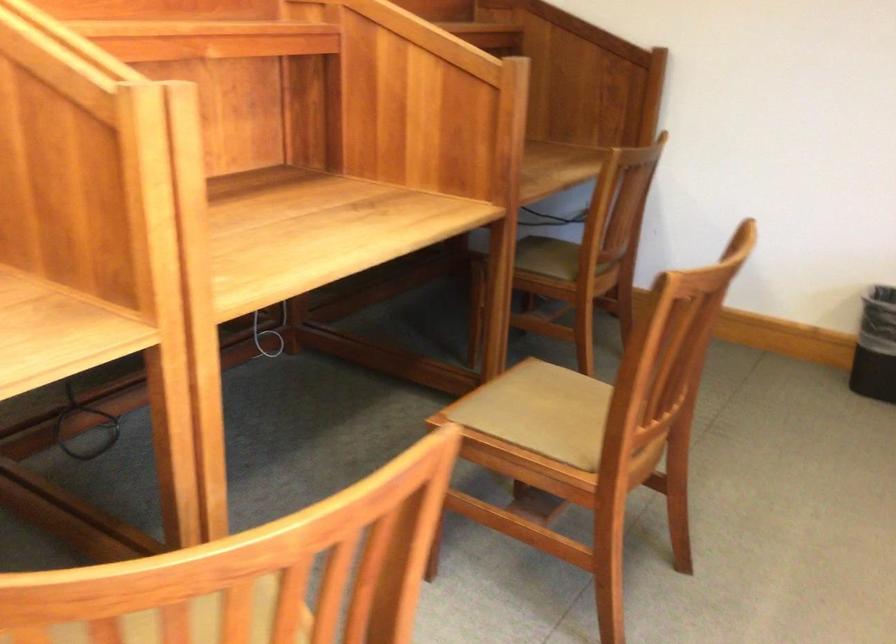
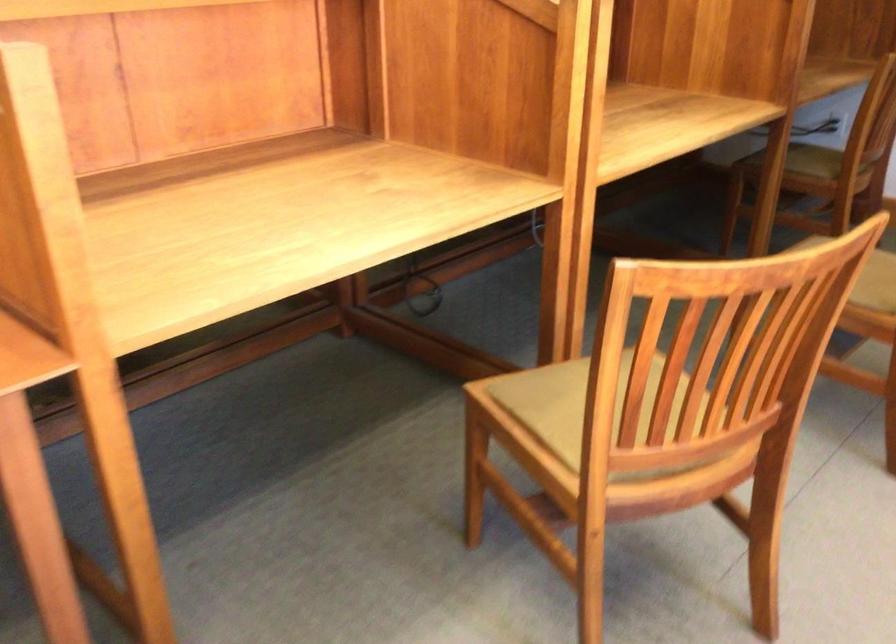
The images are taken continuously from a first-person perspective. In which direction are you moving?

The movement direction of the cameraman is left, backward.